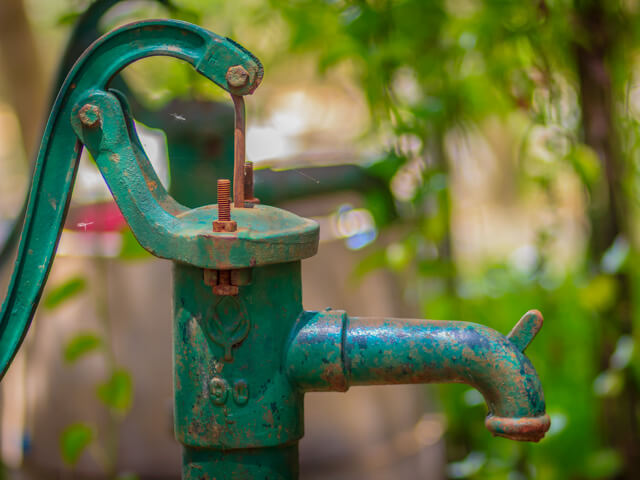
The width and height of the screenshot is (640, 480). In order to click on small peice of spider web under handle on the left in this screenshot , I will do `click(84, 224)`.